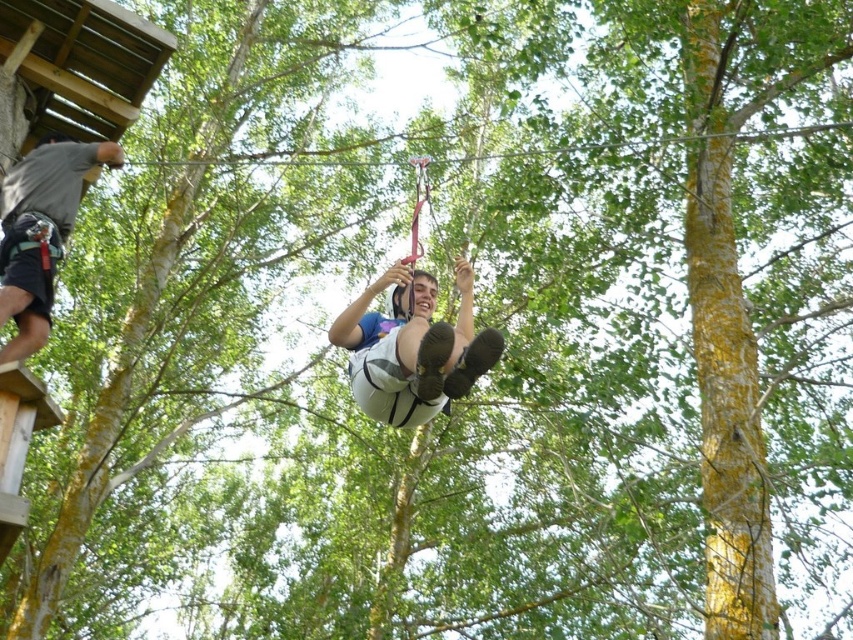
Question: Does white fabric harness at center have a smaller size compared to gray fabric harness at upper left?

Choices:
 (A) no
 (B) yes

Answer: (B)

Question: Where is white fabric harness at center located in relation to gray fabric harness at upper left in the image?

Choices:
 (A) below
 (B) above

Answer: (A)

Question: Which of the following is the farthest from the observer?

Choices:
 (A) white fabric harness at center
 (B) gray fabric harness at upper left

Answer: (B)

Question: Does white fabric harness at center have a greater width compared to gray fabric harness at upper left?

Choices:
 (A) no
 (B) yes

Answer: (B)

Question: Among these points, which one is nearest to the camera?

Choices:
 (A) (347, 333)
 (B) (71, 224)

Answer: (A)